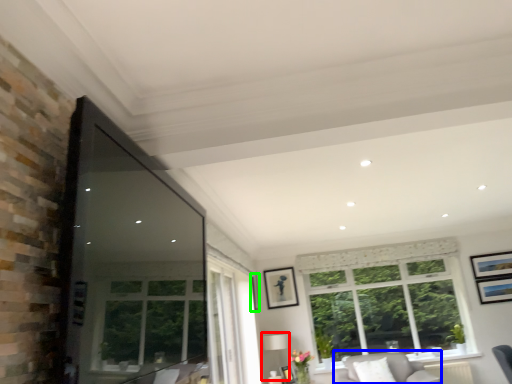
Question: Which is farther away from lamp (highlighted by a red box)? couch (highlighted by a blue box) or picture frame (highlighted by a green box)?

Choices:
 (A) couch
 (B) picture frame

Answer: (A)